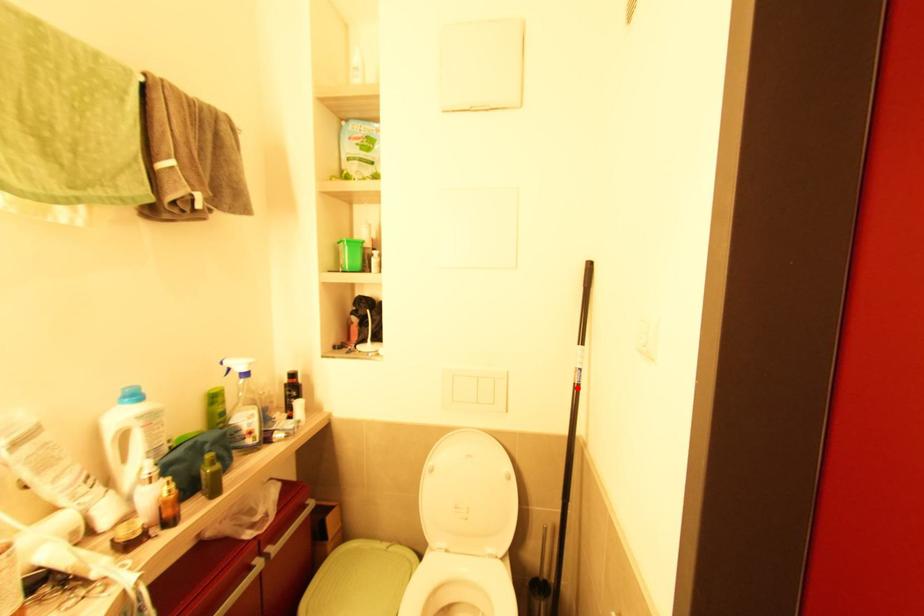
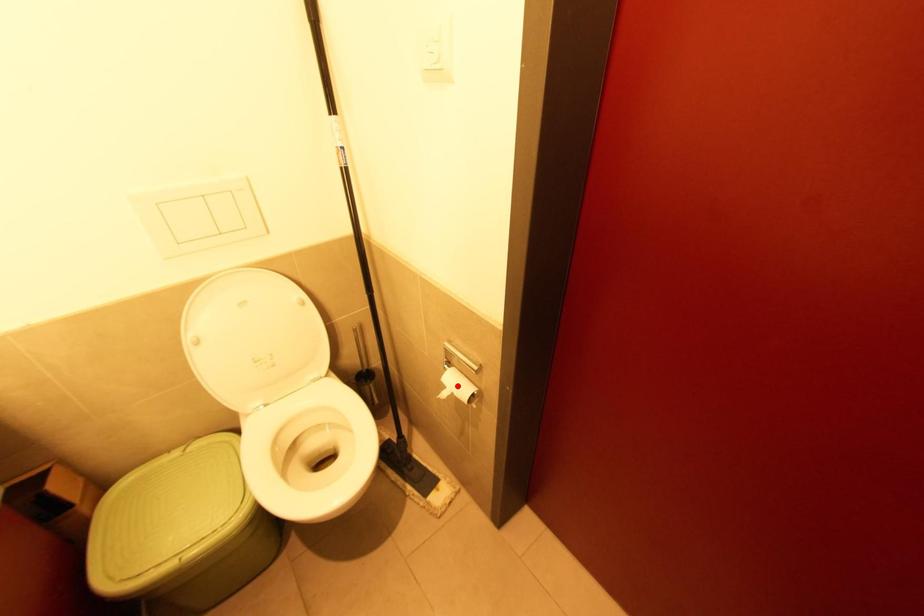
I am providing you with two images of the same scene from different viewpoints. A red point is marked on the first image and another point is marked on the second image. Are the points marked in image1 and image2 representing the same 3D position?

No